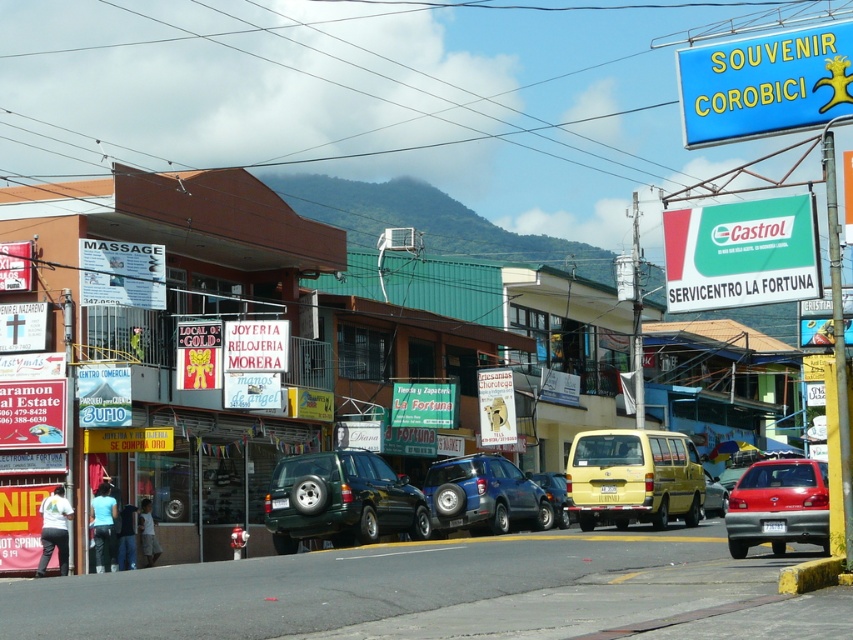
Question: Which object is farther from the camera taking this photo?

Choices:
 (A) matte black suv at center
 (B) blue matte suv at center
 (C) metallic silver suv at center

Answer: (B)

Question: Which point appears farthest from the camera in this image?

Choices:
 (A) (795, 540)
 (B) (709, 273)
 (C) (560, 499)
 (D) (399, 499)

Answer: (C)

Question: Which of the following is the farthest from the observer?

Choices:
 (A) (560, 528)
 (B) (428, 504)
 (C) (786, 465)
 (D) (259, 65)

Answer: (D)

Question: Can you confirm if green matte suv at center is positioned above yellow matte van at center?

Choices:
 (A) no
 (B) yes

Answer: (A)

Question: Does blue plastic signboard at upper right appear on the right side of metallic silver suv at center?

Choices:
 (A) yes
 (B) no

Answer: (A)

Question: Is metallic red car at lower right to the left of blue matte suv at center from the viewer's perspective?

Choices:
 (A) no
 (B) yes

Answer: (A)